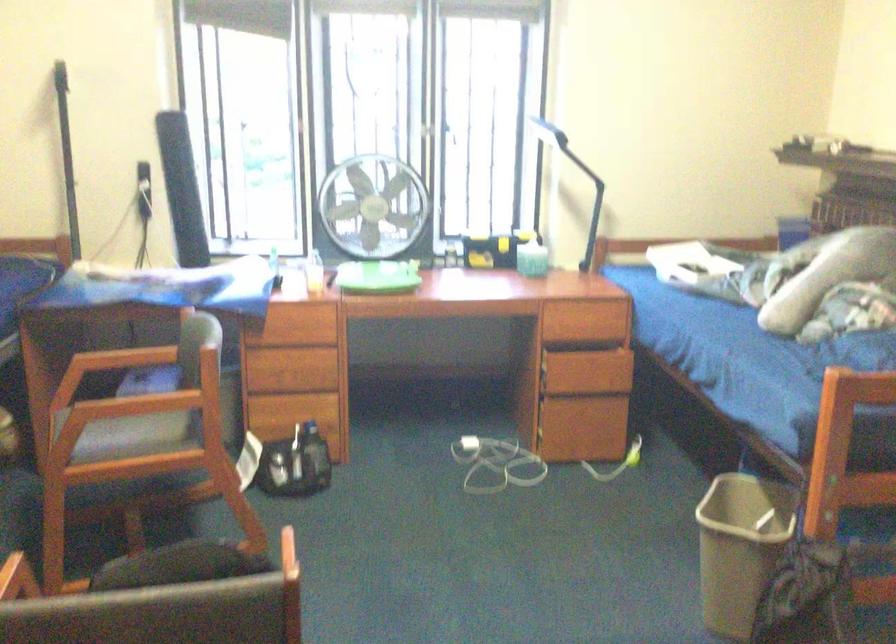
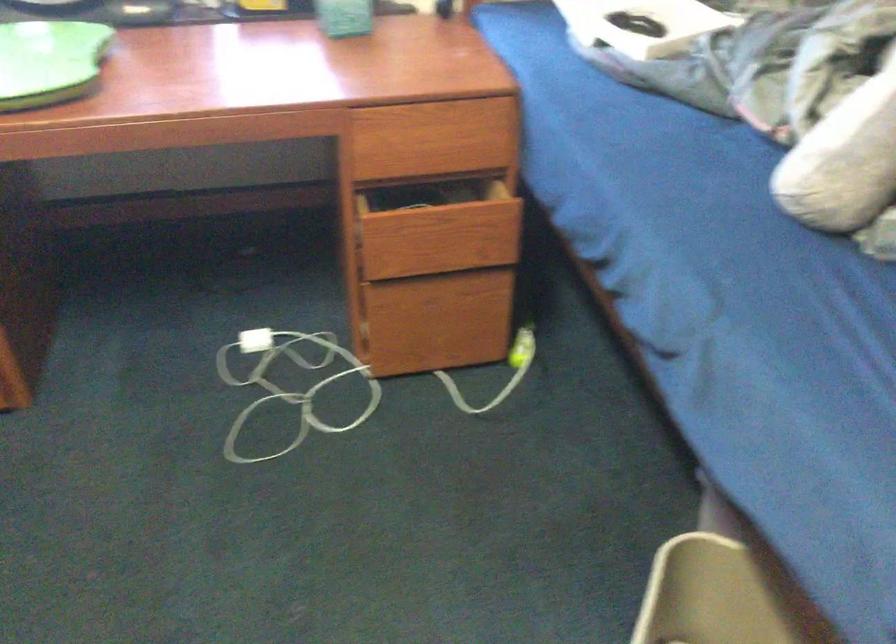
The point at (x=599, y=375) is marked in the first image. Where is the corresponding point in the second image?

(458, 242)